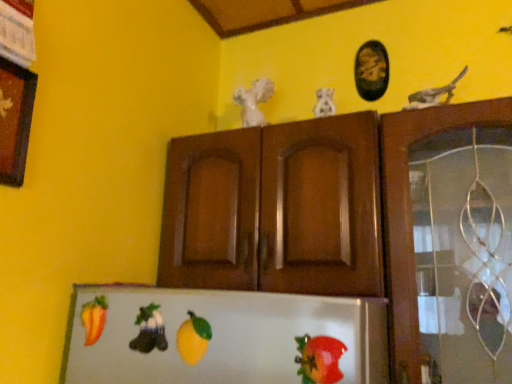
Question: Does shiny plastic tomato at lower right have a lesser width compared to smooth orange carrot at lower left, which is the 1th fruit in back-to-front order?

Choices:
 (A) no
 (B) yes

Answer: (B)

Question: Considering the relative positions of shiny plastic tomato at lower right and smooth orange carrot at lower left, which is the 1th fruit in left-to-right order, in the image provided, is shiny plastic tomato at lower right to the left of smooth orange carrot at lower left, which is the 1th fruit in left-to-right order, from the viewer's perspective?

Choices:
 (A) yes
 (B) no

Answer: (B)

Question: Is shiny plastic tomato at lower right turned away from smooth orange carrot at lower left, the second fruit viewed from the right?

Choices:
 (A) yes
 (B) no

Answer: (B)

Question: From a real-world perspective, is shiny plastic tomato at lower right over smooth orange carrot at lower left, which is the 1th fruit in left-to-right order?

Choices:
 (A) no
 (B) yes

Answer: (A)

Question: From the image's perspective, is shiny plastic tomato at lower right located beneath smooth orange carrot at lower left, the second fruit viewed from the right?

Choices:
 (A) yes
 (B) no

Answer: (A)

Question: Does shiny plastic tomato at lower right turn towards smooth orange carrot at lower left, which is the 1th fruit in left-to-right order?

Choices:
 (A) yes
 (B) no

Answer: (B)

Question: Is shiny plastic tomato at lower right closer to the viewer compared to black oval frame at upper center, which ranks as the first picture frame in right-to-left order?

Choices:
 (A) yes
 (B) no

Answer: (A)

Question: Is shiny plastic tomato at lower right oriented away from black oval frame at upper center, which ranks as the 2th picture frame in left-to-right order?

Choices:
 (A) no
 (B) yes

Answer: (A)

Question: Does shiny plastic tomato at lower right appear on the left side of black oval frame at upper center, the second picture frame when ordered from bottom to top?

Choices:
 (A) no
 (B) yes

Answer: (B)

Question: Does shiny plastic tomato at lower right lie behind black oval frame at upper center, the second picture frame when ordered from bottom to top?

Choices:
 (A) no
 (B) yes

Answer: (A)

Question: Is shiny plastic tomato at lower right not close to black oval frame at upper center, placed as the 1th picture frame when sorted from top to bottom?

Choices:
 (A) no
 (B) yes

Answer: (A)

Question: Is shiny plastic tomato at lower right facing towards black oval frame at upper center, which ranks as the 2th picture frame in left-to-right order?

Choices:
 (A) no
 (B) yes

Answer: (A)

Question: Is black oval frame at upper center, positioned as the second picture frame in front-to-back order, at the left side of yellow matte lemon at center, which is the 1th fruit from right to left?

Choices:
 (A) yes
 (B) no

Answer: (B)